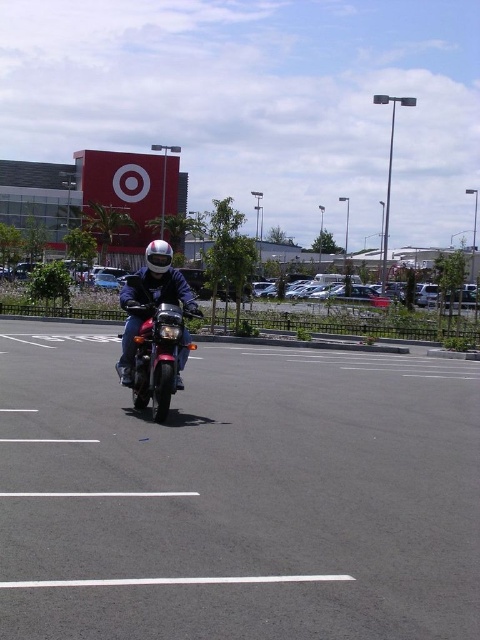
Question: Which of these objects is positioned farthest from the black asphalt parking lot at center?

Choices:
 (A) shiny silver helmet at center
 (B) shiny chrome motorbike at center

Answer: (A)

Question: Which object is positioned closest to the shiny chrome motorbike at center?

Choices:
 (A) black asphalt parking lot at center
 (B) shiny silver helmet at center

Answer: (B)

Question: Can you confirm if black asphalt parking lot at center is bigger than shiny silver helmet at center?

Choices:
 (A) no
 (B) yes

Answer: (B)

Question: Considering the relative positions of black asphalt parking lot at center and shiny silver helmet at center in the image provided, where is black asphalt parking lot at center located with respect to shiny silver helmet at center?

Choices:
 (A) below
 (B) above

Answer: (A)

Question: Is black asphalt parking lot at center thinner than shiny chrome motorbike at center?

Choices:
 (A) no
 (B) yes

Answer: (A)

Question: Which point is farther to the camera?

Choices:
 (A) (83, 461)
 (B) (182, 305)
 (C) (192, 305)

Answer: (B)